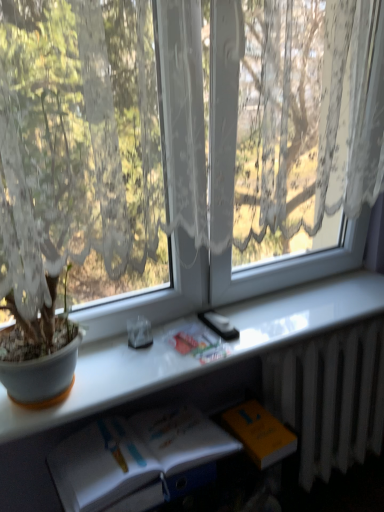
This screenshot has height=512, width=384. In order to click on free space to the back side of matte plastic book at center, marked as the 2th book in a bottom-to-top arrangement in this screenshot , I will do `click(200, 319)`.